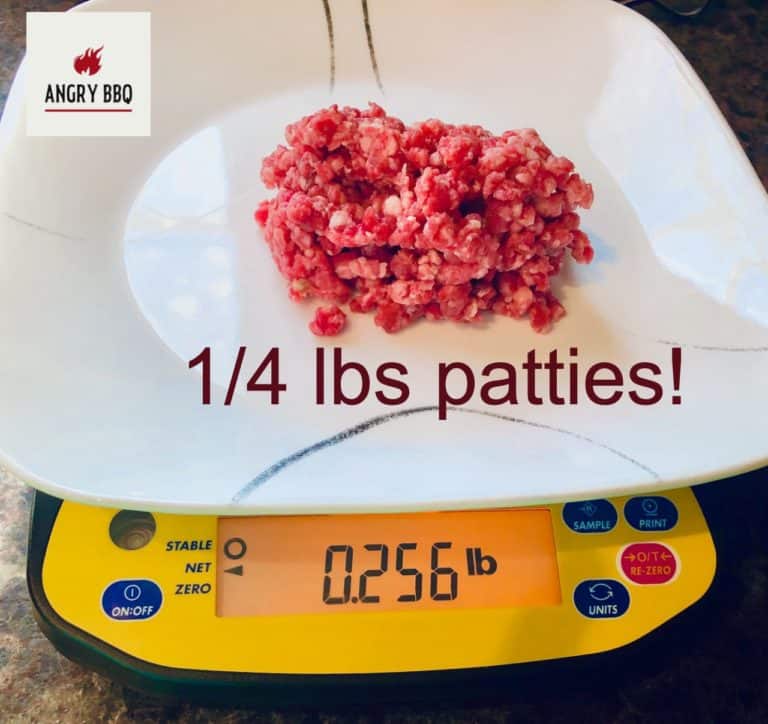
Where is `black digital numbers is 0.256 lb indicated on the digital display`? This screenshot has width=768, height=724. black digital numbers is 0.256 lb indicated on the digital display is located at coordinates (445, 586).